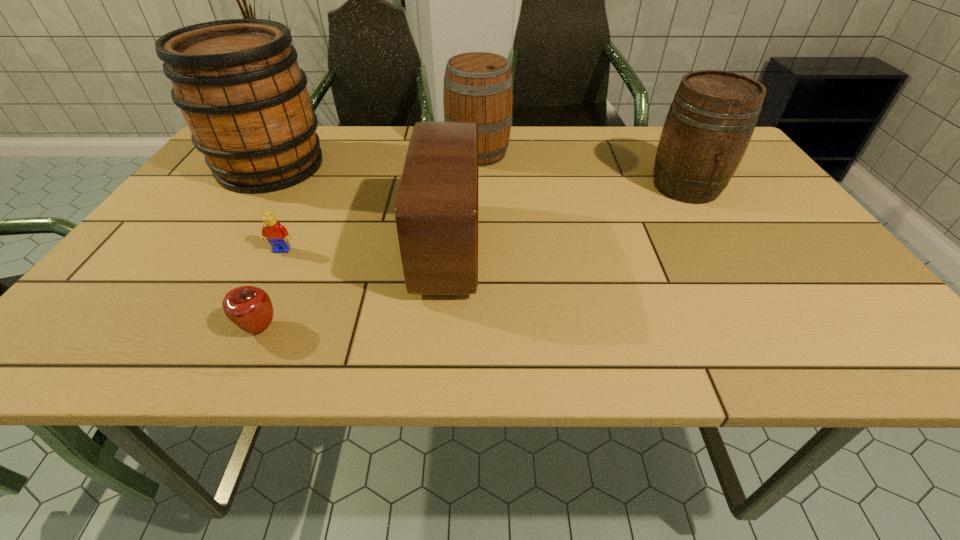
Where is `vacant space located 0.250m on the front-facing side of the radio receiver`? Image resolution: width=960 pixels, height=540 pixels. vacant space located 0.250m on the front-facing side of the radio receiver is located at coordinates (595, 248).

Find the location of a particular element. free space located 0.100m on the front-facing side of the Lego is located at coordinates (x=263, y=287).

You are a GUI agent. You are given a task and a screenshot of the screen. Output one action in this format:
    pyautogui.click(x=<x>, y=<y>)
    Task: Click on the free location located 0.140m on the left of the apple
    The width and height of the screenshot is (960, 540).
    Given the screenshot: What is the action you would take?
    pyautogui.click(x=160, y=328)

You are a GUI agent. You are given a task and a screenshot of the screen. Output one action in this format:
    pyautogui.click(x=<x>, y=<y>)
    Task: Click on the object located at the near edge
    
    Given the screenshot: What is the action you would take?
    pyautogui.click(x=250, y=308)

Find the location of a particular element. object that is at the left edge is located at coordinates (243, 96).

The height and width of the screenshot is (540, 960). I want to click on object at the right edge, so click(712, 117).

The width and height of the screenshot is (960, 540). What are the coordinates of `object that is at the far left corner` in the screenshot? It's located at (243, 96).

Find the location of a particular element. The width and height of the screenshot is (960, 540). object at the far right corner is located at coordinates (712, 117).

Find the location of a particular element. free space at the near edge is located at coordinates (257, 347).

Where is `free space at the left edge of the desktop`? This screenshot has height=540, width=960. free space at the left edge of the desktop is located at coordinates (139, 304).